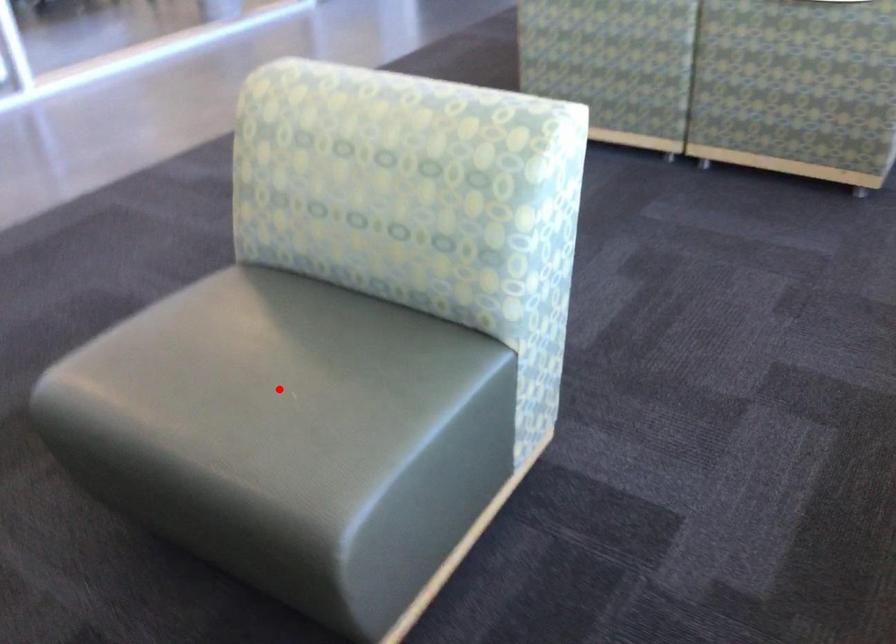
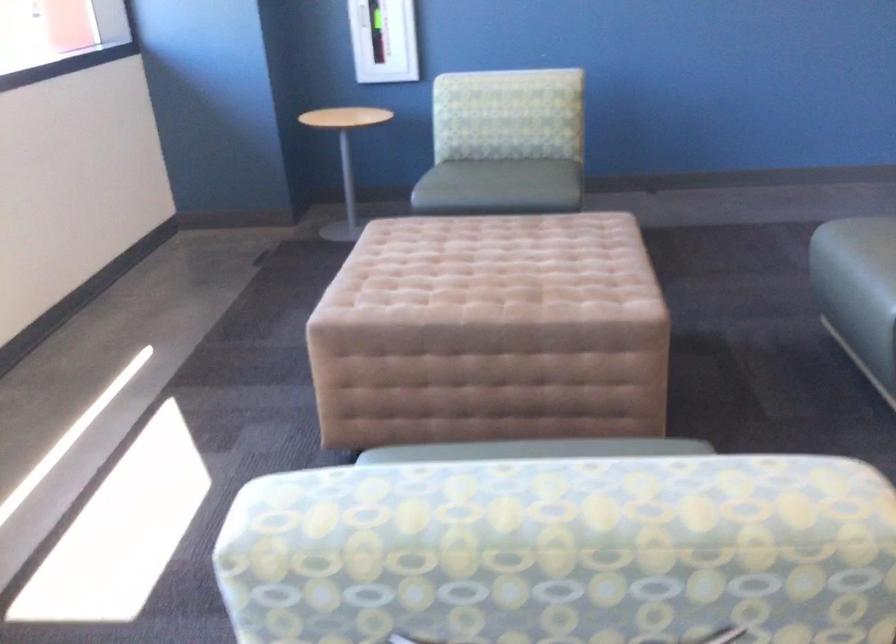
Question: I am providing you with two images of the same scene from different viewpoints. A red point is marked on the first image. At the location where the point appears in image 1, is it still visible in image 2?

Choices:
 (A) Yes
 (B) No

Answer: (B)